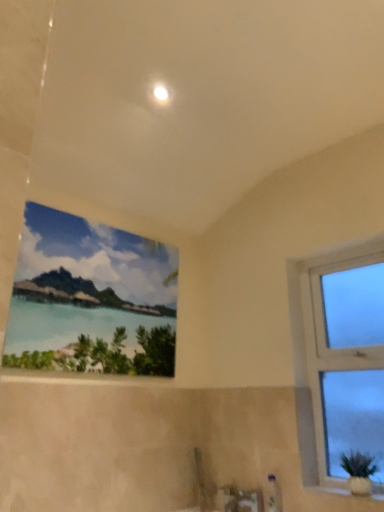
Question: Is white glossy window sill at lower right wider than watercolor painting at upper center, the second window viewed from the right?

Choices:
 (A) no
 (B) yes

Answer: (B)

Question: Is white glossy window sill at lower right not close to watercolor painting at upper center, the second window viewed from the right?

Choices:
 (A) no
 (B) yes

Answer: (B)

Question: From the image's perspective, would you say white glossy window sill at lower right is positioned over watercolor painting at upper center, the second window viewed from the right?

Choices:
 (A) yes
 (B) no

Answer: (B)

Question: Can you confirm if white glossy window sill at lower right is bigger than watercolor painting at upper center, the 1th window in the left-to-right sequence?

Choices:
 (A) no
 (B) yes

Answer: (A)

Question: From a real-world perspective, does white glossy window sill at lower right stand above watercolor painting at upper center, the 1th window in the left-to-right sequence?

Choices:
 (A) yes
 (B) no

Answer: (B)

Question: Looking at their shapes, would you say white glossy window sill at lower right is wider or thinner than watercolor painting at upper center, the second window viewed from the right?

Choices:
 (A) thin
 (B) wide

Answer: (B)

Question: Is white glossy window sill at lower right to the left or to the right of watercolor painting at upper center, the second window viewed from the right, in the image?

Choices:
 (A) left
 (B) right

Answer: (B)

Question: In terms of height, does white glossy window sill at lower right look taller or shorter compared to watercolor painting at upper center, the 1th window in the left-to-right sequence?

Choices:
 (A) tall
 (B) short

Answer: (B)

Question: From a real-world perspective, is white glossy window sill at lower right physically located above or below watercolor painting at upper center, the second window viewed from the right?

Choices:
 (A) below
 (B) above

Answer: (A)

Question: Is point (117, 273) positioned closer to the camera than point (360, 484)?

Choices:
 (A) farther
 (B) closer

Answer: (A)

Question: From the image's perspective, is watercolor painting at upper center, the 1th window in the left-to-right sequence, positioned above or below white glossy window sill at lower right?

Choices:
 (A) below
 (B) above

Answer: (B)

Question: Would you say watercolor painting at upper center, the second window viewed from the right, is inside or outside white glossy window sill at lower right?

Choices:
 (A) outside
 (B) inside

Answer: (A)

Question: Considering the relative positions of watercolor painting at upper center, the 1th window in the left-to-right sequence, and white glossy window sill at lower right in the image provided, is watercolor painting at upper center, the 1th window in the left-to-right sequence, to the left or to the right of white glossy window sill at lower right?

Choices:
 (A) right
 (B) left

Answer: (B)

Question: Considering the positions of point (129, 238) and point (360, 495), is point (129, 238) closer or farther from the camera than point (360, 495)?

Choices:
 (A) farther
 (B) closer

Answer: (A)

Question: From the image's perspective, is watercolor painting at upper center, the 1th window in the left-to-right sequence, positioned above or below green matte plant at lower right?

Choices:
 (A) below
 (B) above

Answer: (B)